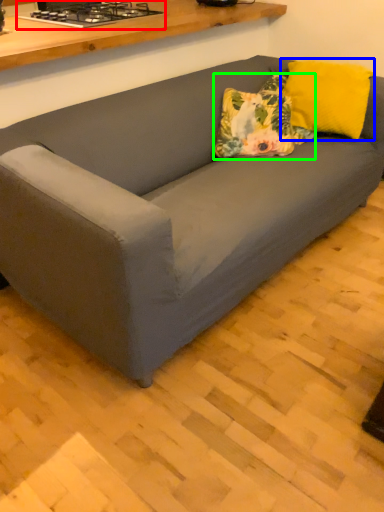
Question: Considering the real-world distances, which object is closest to stove (highlighted by a red box)? pillow (highlighted by a blue box) or throw pillow (highlighted by a green box).

Choices:
 (A) pillow
 (B) throw pillow

Answer: (B)